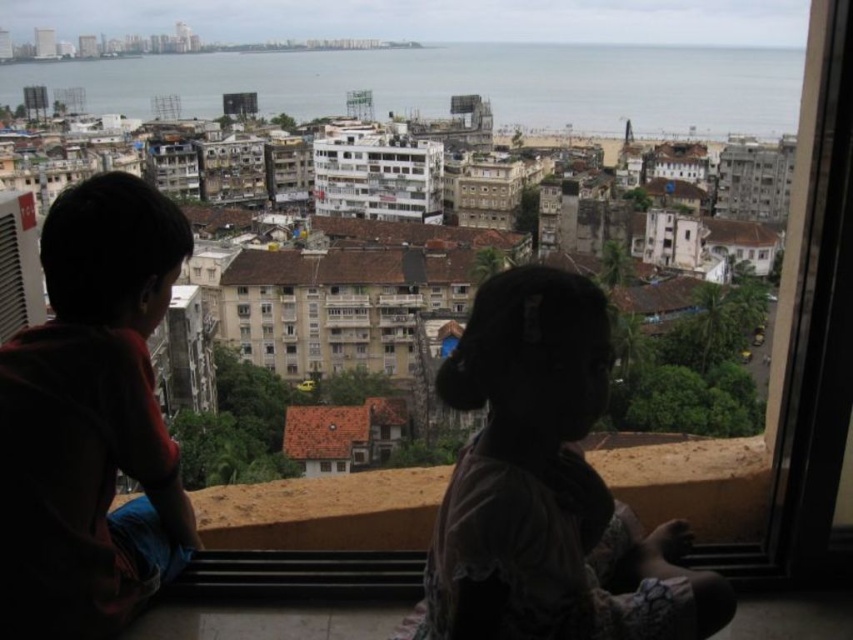
You are an interior designer assessing the view from this window. You notice the silhouette fabric at center and the transparent glass window at center. Which object has a greater width?

The silhouette fabric at center has a greater width than the transparent glass window at center.